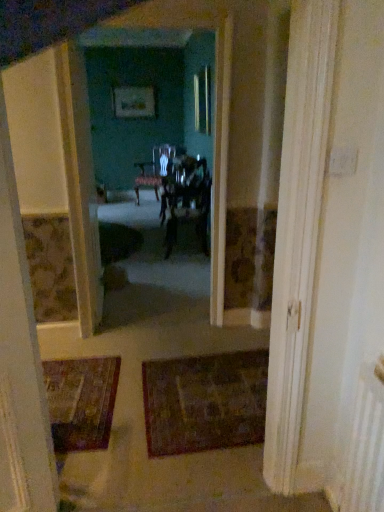
Question: Considering the relative sizes of dark brown textured rug at center and matte white door at center in the image provided, is dark brown textured rug at center bigger than matte white door at center?

Choices:
 (A) yes
 (B) no

Answer: (B)

Question: Is dark brown textured rug at center to the right of matte white door at center from the viewer's perspective?

Choices:
 (A) no
 (B) yes

Answer: (B)

Question: Would you consider dark brown textured rug at center to be distant from matte white door at center?

Choices:
 (A) no
 (B) yes

Answer: (B)

Question: Considering the relative positions of dark brown textured rug at center and matte white door at center in the image provided, is dark brown textured rug at center to the left of matte white door at center from the viewer's perspective?

Choices:
 (A) yes
 (B) no

Answer: (B)

Question: Does dark brown textured rug at center come behind matte white door at center?

Choices:
 (A) yes
 (B) no

Answer: (B)

Question: Is matte black chair at center, which is the 1th chair in back-to-front order, bigger or smaller than dark brown textured rug at center?

Choices:
 (A) small
 (B) big

Answer: (B)

Question: From the image's perspective, is matte black chair at center, the 2th chair from the right, located above or below dark brown textured rug at center?

Choices:
 (A) below
 (B) above

Answer: (B)

Question: Looking at their shapes, would you say matte black chair at center, the 2th chair from the right, is wider or thinner than dark brown textured rug at center?

Choices:
 (A) wide
 (B) thin

Answer: (B)

Question: From a real-world perspective, is matte black chair at center, the 2th chair from the right, above or below dark brown textured rug at center?

Choices:
 (A) below
 (B) above

Answer: (B)

Question: Considering the positions of matte black chair at center, the first chair in the left-to-right sequence, and matte white door at center in the image, is matte black chair at center, the first chair in the left-to-right sequence, bigger or smaller than matte white door at center?

Choices:
 (A) big
 (B) small

Answer: (A)

Question: Considering their positions, is matte black chair at center, the second chair from the front, located in front of or behind matte white door at center?

Choices:
 (A) front
 (B) behind

Answer: (B)

Question: From a real-world perspective, relative to matte white door at center, is matte black chair at center, the second chair from the front, vertically above or below?

Choices:
 (A) below
 (B) above

Answer: (A)

Question: From the image's perspective, is matte black chair at center, which is the 1th chair in back-to-front order, positioned above or below matte white door at center?

Choices:
 (A) above
 (B) below

Answer: (A)

Question: From a real-world perspective, is matte white door at center above or below dark brown textured rug at center?

Choices:
 (A) above
 (B) below

Answer: (A)

Question: Considering the relative positions of matte white door at center and dark brown textured rug at center in the image provided, is matte white door at center to the left or to the right of dark brown textured rug at center?

Choices:
 (A) right
 (B) left

Answer: (B)